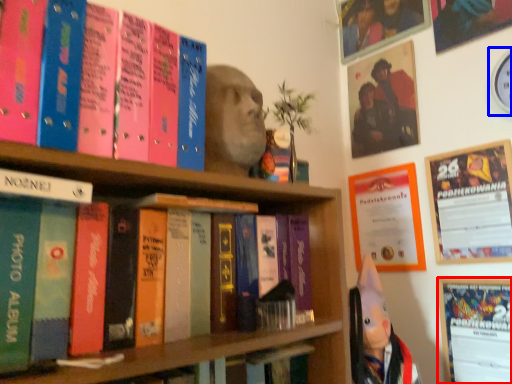
Question: Which of the following is the farthest to the observer, bulletin board (highlighted by a red box) or clock (highlighted by a blue box)?

Choices:
 (A) bulletin board
 (B) clock

Answer: (A)